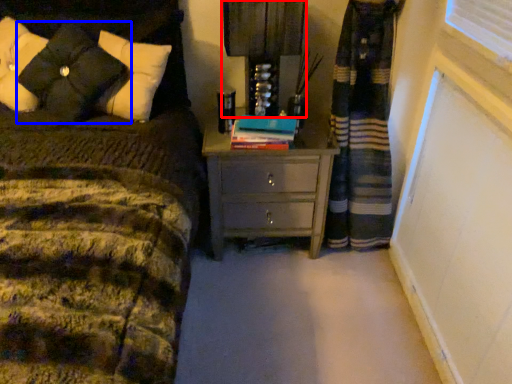
Question: Which object is closer to the camera taking this photo, bedside lamp (highlighted by a red box) or pillow (highlighted by a blue box)?

Choices:
 (A) bedside lamp
 (B) pillow

Answer: (B)